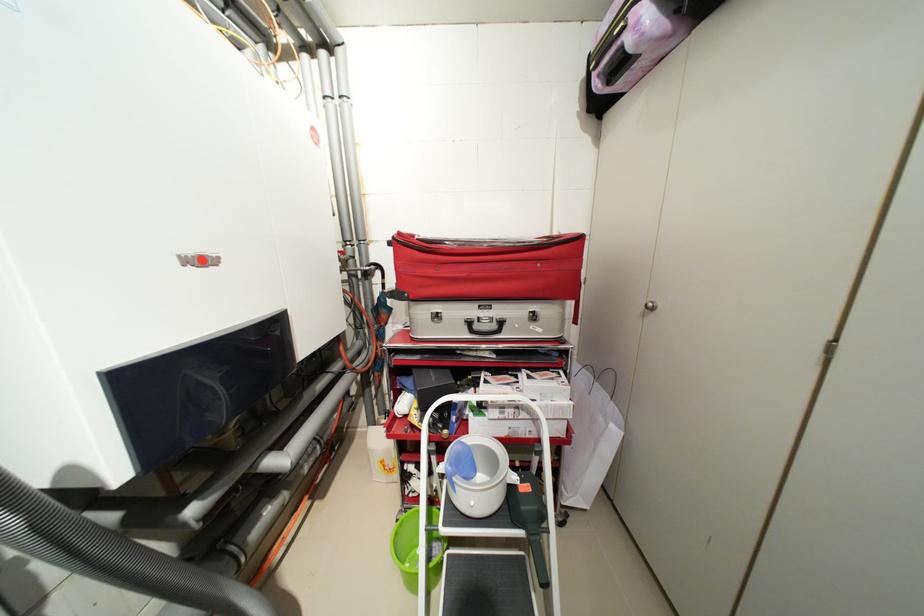
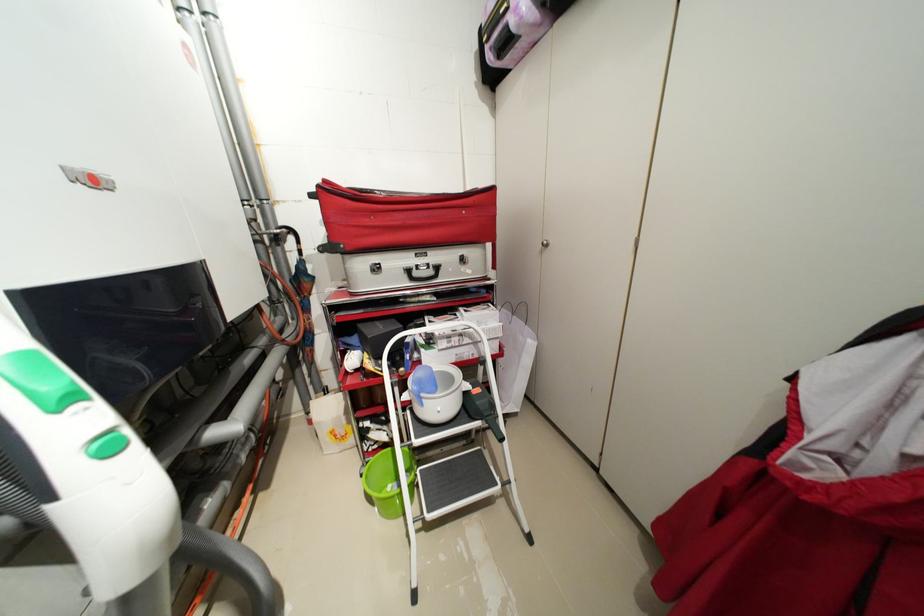
What movement of the cameraman would produce the second image?

The movement direction of the cameraman is left, backward.